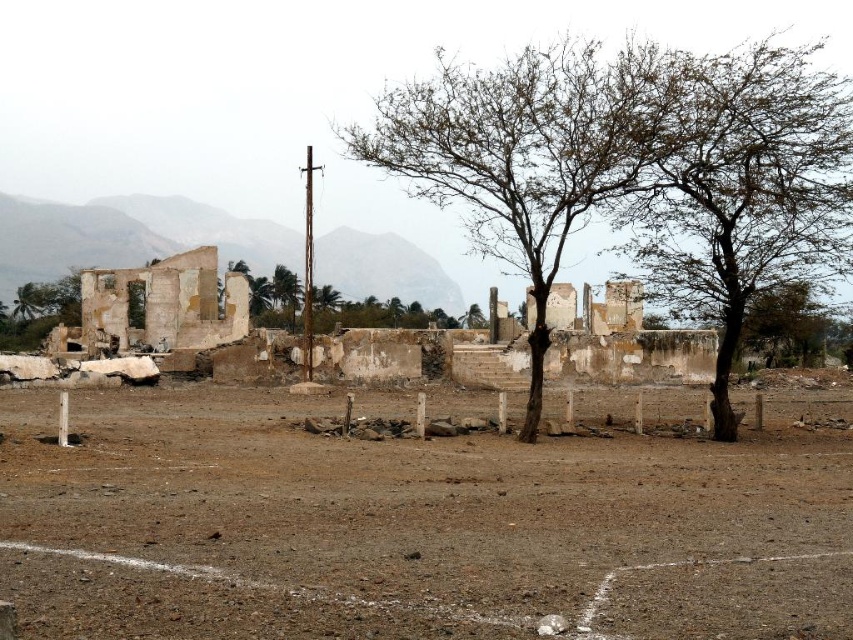
Which is in front, point (525, 225) or point (462, 323)?

Positioned in front is point (525, 225).

Is point (456, 196) less distant than point (463, 316)?

No, (456, 196) is behind (463, 316).

What do you see at coordinates (527, 150) in the screenshot? I see `brown leafy tree at center` at bounding box center [527, 150].

At what (x,y) coordinates should I click in order to perform the action: click on brown leafy tree at center. Please return your answer as a coordinate pair (x, y). Image resolution: width=853 pixels, height=640 pixels. Looking at the image, I should click on (527, 150).

Can you confirm if weathered concrete ruins at center is thinner than white concrete pillar at center?

No, weathered concrete ruins at center is not thinner than white concrete pillar at center.

Looking at this image, measure the distance between point (109, 275) and camera.

Point (109, 275) and camera are 72.61 meters apart from each other.

Between point (204, 323) and point (61, 429), which one is positioned in front?

Positioned in front is point (61, 429).

Locate an element on the screen. Image resolution: width=853 pixels, height=640 pixels. weathered concrete ruins at center is located at coordinates (158, 307).

This screenshot has width=853, height=640. What do you see at coordinates (412, 525) in the screenshot?
I see `brown dirt field at center` at bounding box center [412, 525].

Find the location of `brown dirt field at center`. brown dirt field at center is located at coordinates (412, 525).